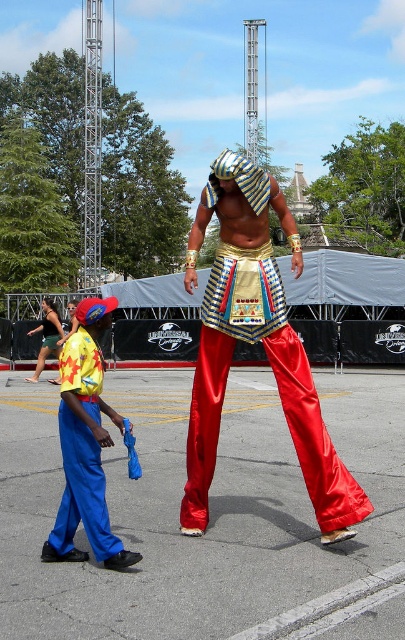
You are a photographer at Universal Orlando and need to capture a photo of both the shiny red pants at center and the blue satin pants at lower left in the same frame. Given their height difference, which pants should you focus on first to ensure both are in focus?

The shiny red pants at center are taller than the blue satin pants at lower left. To ensure both are in focus, focus on the shiny red pants at center first since it is taller and likely farther away, allowing the blue satin pants at lower left to remain in the depth of field.

You are a performer wearing the shiny red pants at center and need to reach the blue satin pants at lower left to retrieve a prop. Can you comfortably reach them without moving your feet?

The distance between the shiny red pants at center and the blue satin pants at lower left is 1.25 meters. Since this distance is greater than the typical arm length of a person, you cannot comfortably reach the blue satin pants at lower left without moving your feet.